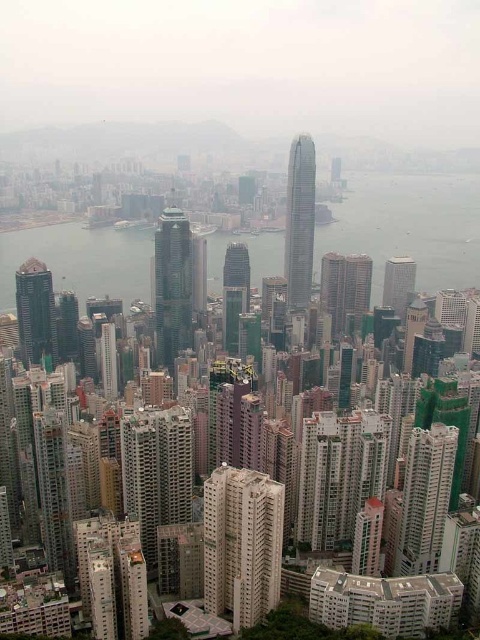
Question: Among these points, which one is nearest to the camera?

Choices:
 (A) (79, 301)
 (B) (40, 276)

Answer: (B)

Question: Does beige concrete building at center have a smaller size compared to smooth glass skyscraper at center?

Choices:
 (A) no
 (B) yes

Answer: (B)

Question: Which point is farther from the camera taking this photo?

Choices:
 (A) (308, 236)
 (B) (400, 317)

Answer: (A)

Question: Which object is the closest to the green glass skyscraper at left?

Choices:
 (A) glassy steel skyscraper at center
 (B) smooth glass skyscraper at center

Answer: (A)

Question: Is clear water at center to the right of green glass skyscraper at center from the viewer's perspective?

Choices:
 (A) yes
 (B) no

Answer: (A)

Question: Is green glass skyscraper at center to the left of smooth glass skyscraper at center from the viewer's perspective?

Choices:
 (A) no
 (B) yes

Answer: (B)